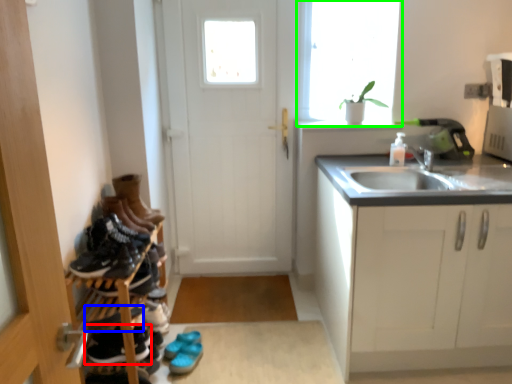
Question: Which object is the farthest from footwear (highlighted by a red box)? Choose among these: shoe (highlighted by a blue box) or window (highlighted by a green box).

Choices:
 (A) shoe
 (B) window

Answer: (B)